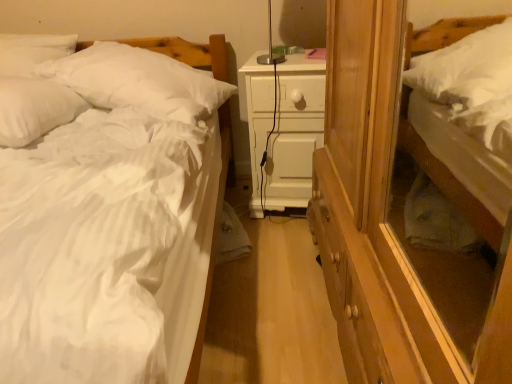
Question: Can you confirm if white soft bed at right, which is counted as the 1th bed, starting from the right, is thinner than white soft pillow at upper left, which is the second pillow in left-to-right order?

Choices:
 (A) no
 (B) yes

Answer: (B)

Question: Is white soft bed at right, marked as the 2th bed in a left-to-right arrangement, outside white soft pillow at upper left, placed as the first pillow when sorted from right to left?

Choices:
 (A) no
 (B) yes

Answer: (B)

Question: Can you confirm if white soft bed at right, which is counted as the 1th bed, starting from the right, is wider than white soft pillow at upper left, which is the second pillow in left-to-right order?

Choices:
 (A) yes
 (B) no

Answer: (B)

Question: Is white soft bed at right, which is counted as the 1th bed, starting from the right, touching white soft pillow at upper left, placed as the first pillow when sorted from right to left?

Choices:
 (A) no
 (B) yes

Answer: (A)

Question: Does white soft bed at right, marked as the 2th bed in a left-to-right arrangement, appear on the left side of white soft pillow at upper left, placed as the first pillow when sorted from right to left?

Choices:
 (A) yes
 (B) no

Answer: (B)

Question: From a real-world perspective, is white soft bed at left, marked as the 1th bed in a left-to-right arrangement, positioned above or below white matte nightstand at center?

Choices:
 (A) below
 (B) above

Answer: (B)

Question: Is white soft bed at left, which is the second bed in right-to-left order, wider or thinner than white matte nightstand at center?

Choices:
 (A) wide
 (B) thin

Answer: (A)

Question: Considering their positions, is white soft bed at left, marked as the 1th bed in a left-to-right arrangement, located in front of or behind white matte nightstand at center?

Choices:
 (A) front
 (B) behind

Answer: (A)

Question: Is white soft bed at left, which is the second bed in right-to-left order, bigger or smaller than white matte nightstand at center?

Choices:
 (A) small
 (B) big

Answer: (B)

Question: Considering the relative positions of white soft bed at right, which is counted as the 1th bed, starting from the right, and white matte nightstand at center in the image provided, is white soft bed at right, which is counted as the 1th bed, starting from the right, to the left or to the right of white matte nightstand at center?

Choices:
 (A) right
 (B) left

Answer: (A)

Question: In terms of height, does white soft bed at right, marked as the 2th bed in a left-to-right arrangement, look taller or shorter compared to white matte nightstand at center?

Choices:
 (A) short
 (B) tall

Answer: (B)

Question: From the image's perspective, is white soft bed at right, which is counted as the 1th bed, starting from the right, above or below white matte nightstand at center?

Choices:
 (A) above
 (B) below

Answer: (A)

Question: Is white soft bed at right, which is counted as the 1th bed, starting from the right, inside the boundaries of white matte nightstand at center, or outside?

Choices:
 (A) outside
 (B) inside

Answer: (A)

Question: In terms of width, does white soft pillow at left, the second pillow viewed from the right, look wider or thinner when compared to white soft bed at right, marked as the 2th bed in a left-to-right arrangement?

Choices:
 (A) wide
 (B) thin

Answer: (A)

Question: Is white soft pillow at left, the second pillow viewed from the right, taller or shorter than white soft bed at right, marked as the 2th bed in a left-to-right arrangement?

Choices:
 (A) tall
 (B) short

Answer: (B)